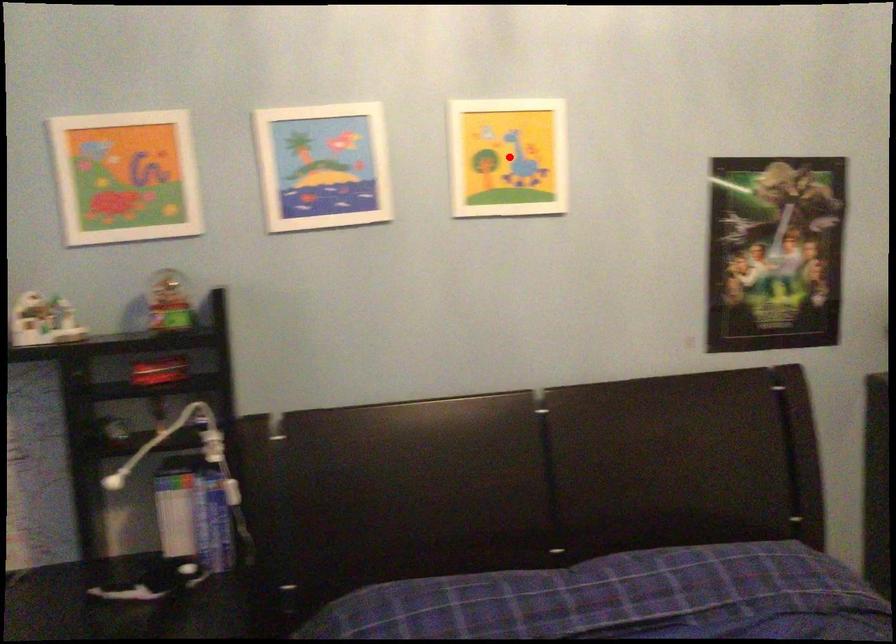
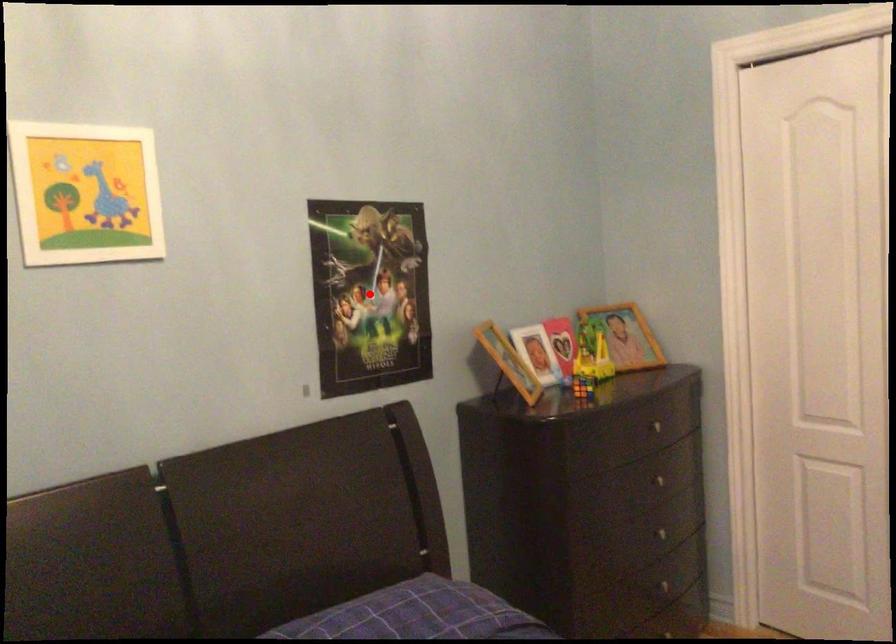
Looking at this image, I am providing you with two images of the same scene from different viewpoints. A red point is marked on the first image and another point is marked on the second image. Is the marked point in image1 the same physical position as the marked point in image2?

No